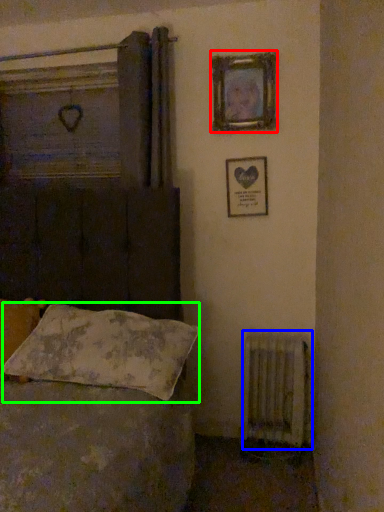
Question: Considering the real-world distances, which object is closest to picture frame (highlighted by a red box)? radiator (highlighted by a blue box) or pillow (highlighted by a green box).

Choices:
 (A) radiator
 (B) pillow

Answer: (B)